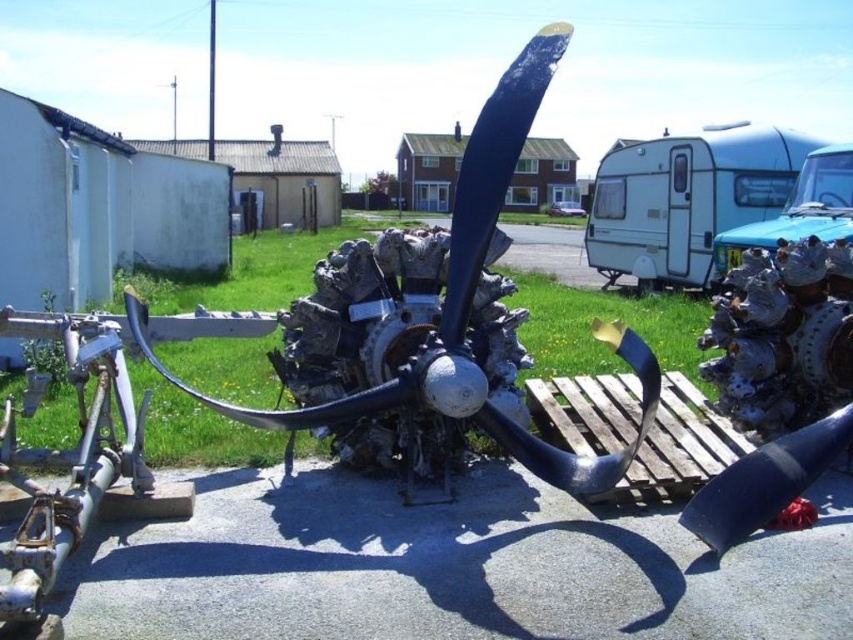
Is blue metallic propeller at center to the right of blue metallic trailer at right from the viewer's perspective?

In fact, blue metallic propeller at center is to the left of blue metallic trailer at right.

Which is behind, point (503, 131) or point (728, 236)?

The point (728, 236) is behind.

The height and width of the screenshot is (640, 853). I want to click on blue metallic propeller at center, so click(469, 304).

Between blue metallic propeller at center and light blue plastic trailer at upper right, which one appears on the left side from the viewer's perspective?

Positioned to the left is blue metallic propeller at center.

Is the position of blue metallic propeller at center more distant than that of light blue plastic trailer at upper right?

No.

What do you see at coordinates (469, 304) in the screenshot?
I see `blue metallic propeller at center` at bounding box center [469, 304].

At what (x,y) coordinates should I click in order to perform the action: click on blue metallic propeller at center. Please return your answer as a coordinate pair (x, y). Image resolution: width=853 pixels, height=640 pixels. Looking at the image, I should click on (469, 304).

Is point (695, 273) in front of point (848, 198)?

No, it is not.

Find the location of a particular element. The width and height of the screenshot is (853, 640). light blue plastic trailer at upper right is located at coordinates (686, 198).